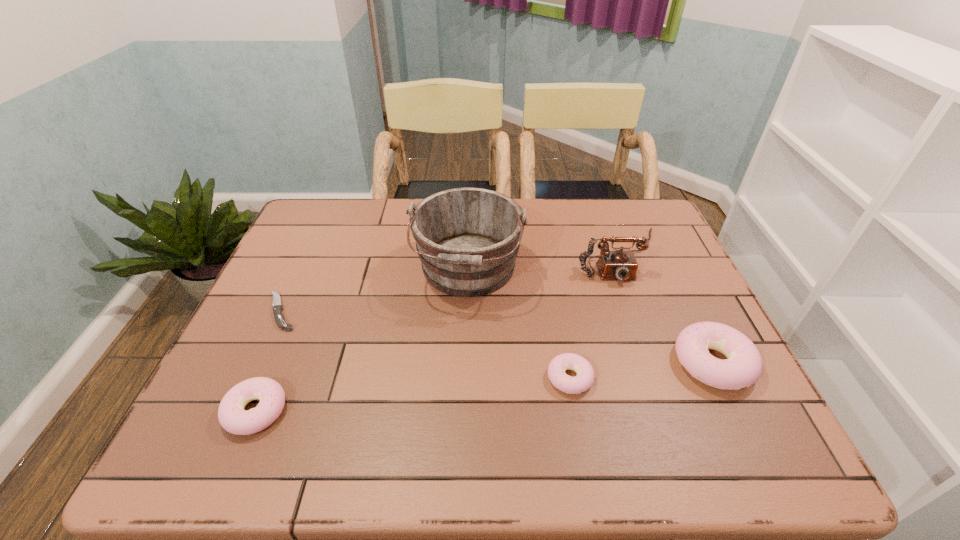
Identify the location of free space located 0.160m on the back of the fourth tallest object. (290, 329).

Where is `free space located 0.160m on the right of the second doughnut from right to left`? The height and width of the screenshot is (540, 960). free space located 0.160m on the right of the second doughnut from right to left is located at coordinates (666, 378).

You are a GUI agent. You are given a task and a screenshot of the screen. Output one action in this format:
    pyautogui.click(x=<x>, y=<y>)
    Task: Click on the vacant point located on the back of the third tallest object
    The image size is (960, 540).
    Given the screenshot: What is the action you would take?
    (x=679, y=293)

Where is `free space located on the left of the fourth object from right to left`? This screenshot has width=960, height=540. free space located on the left of the fourth object from right to left is located at coordinates (384, 269).

Locate an element on the screen. The height and width of the screenshot is (540, 960). vacant space located 0.360m on the dial of the telephone is located at coordinates (675, 406).

Find the location of a particular element. The width and height of the screenshot is (960, 540). vacant space situated on the back of the shortest object is located at coordinates (x=323, y=222).

At what (x,y) coordinates should I click in order to perform the action: click on wine bucket at the far edge. Please return your answer as a coordinate pair (x, y). The width and height of the screenshot is (960, 540). Looking at the image, I should click on (467, 239).

Locate an element on the screen. telephone present at the far edge is located at coordinates (622, 265).

Identify the location of doughnut at the left edge. This screenshot has height=540, width=960. (233, 418).

The image size is (960, 540). I want to click on pocketknife that is positioned at the left edge, so click(277, 307).